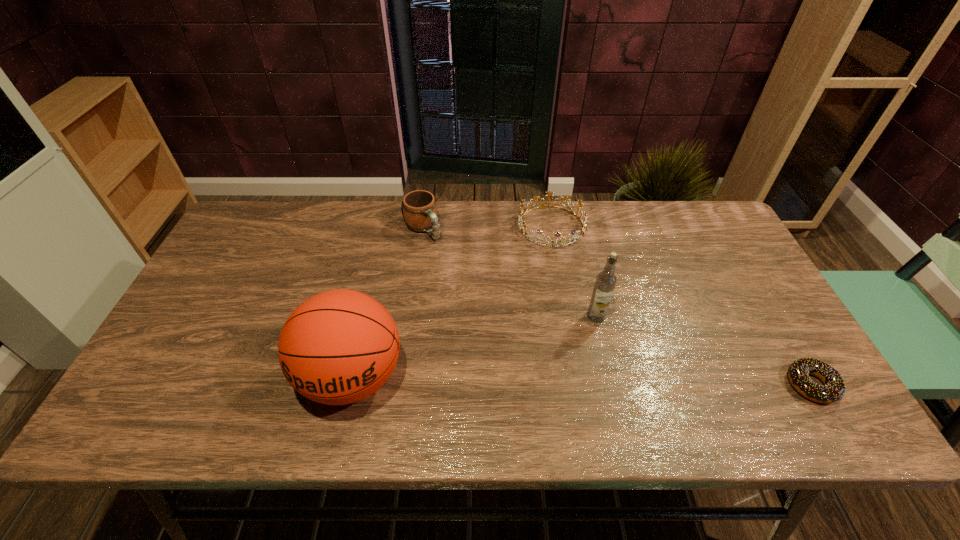
Image resolution: width=960 pixels, height=540 pixels. Identify the location of basketball. (338, 347).

Identify the location of the rightmost object. Image resolution: width=960 pixels, height=540 pixels. (834, 389).

You are a GUI agent. You are given a task and a screenshot of the screen. Output one action in this format:
    pyautogui.click(x=<x>, y=<y>)
    Task: Click on the doughnut
    The width and height of the screenshot is (960, 540).
    Given the screenshot: What is the action you would take?
    pyautogui.click(x=834, y=389)

Locate an element on the screen. The image size is (960, 540). vodka is located at coordinates (606, 280).

Locate an element on the screen. mug is located at coordinates (419, 207).

I want to click on the fourth tallest object, so click(x=522, y=224).

The height and width of the screenshot is (540, 960). I want to click on vacant area situated on the back of the shortest object, so click(757, 293).

This screenshot has height=540, width=960. Identify the location of vacant point located 0.150m on the label of the third nearest object. (553, 354).

Identify the location of vacant space located on the label of the third nearest object. coord(545,362).

The image size is (960, 540). I want to click on free space located 0.210m on the label of the third nearest object, so click(537, 369).